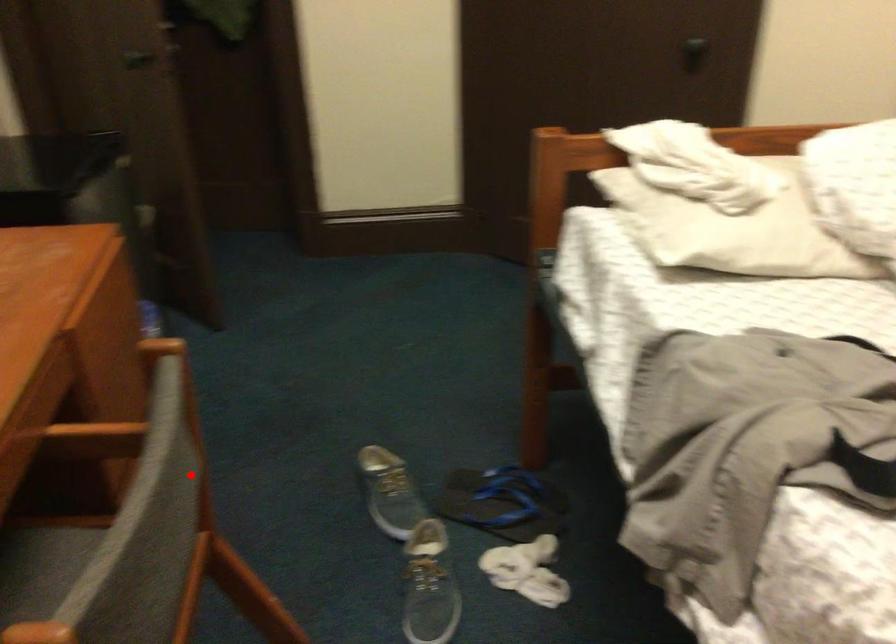
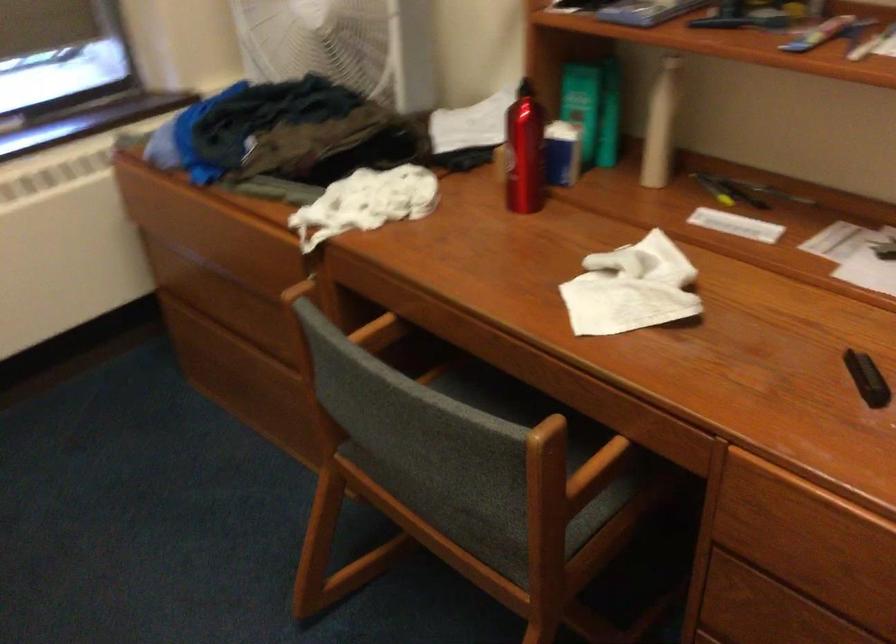
Find the pixel in the second image that matches the highlighted location in the first image.

(488, 509)